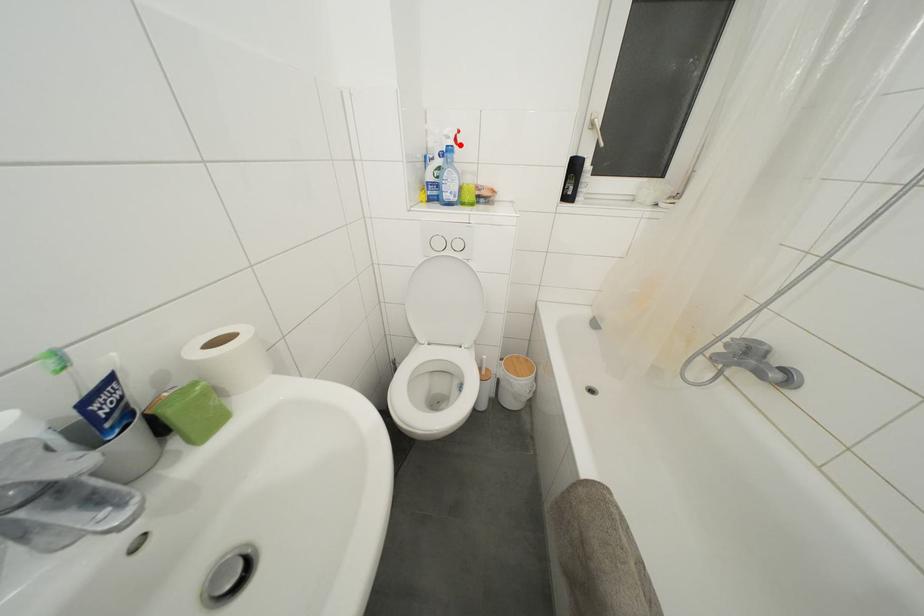
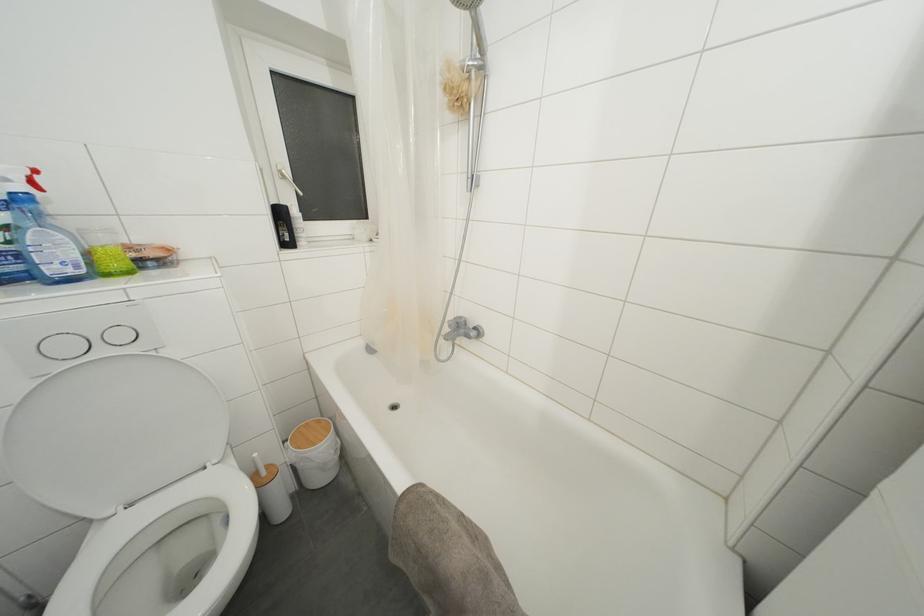
Question: A red point is marked in image1. In image2, is the corresponding 3D point closer to the camera or farther? Reply with the corresponding letter.

Choices:
 (A) The corresponding 3D point is closer.
 (B) The corresponding 3D point is farther.

Answer: (B)